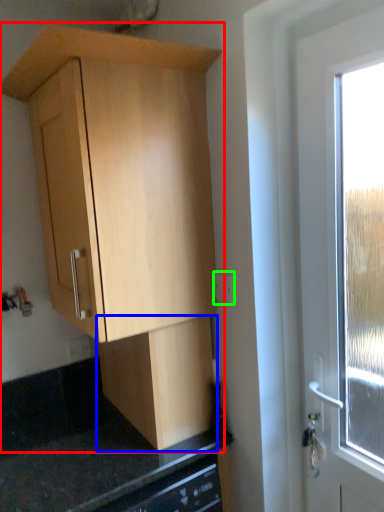
Question: Based on their relative distances, which object is nearer to cabinetry (highlighted by a red box)? Choose from cabinetry (highlighted by a blue box) and electric outlet (highlighted by a green box).

Choices:
 (A) cabinetry
 (B) electric outlet

Answer: (A)